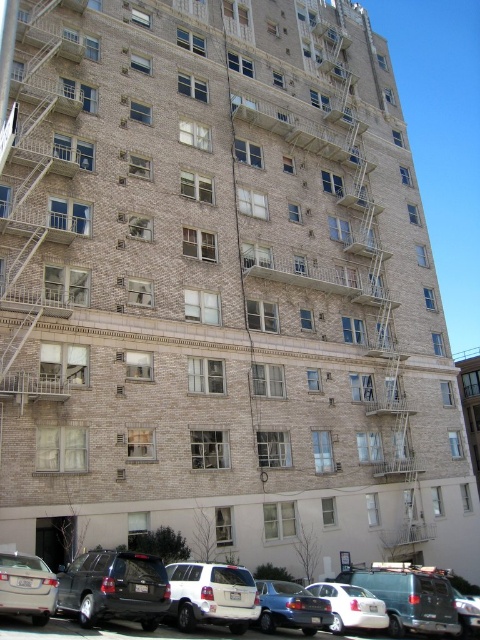
Question: Observing the image, what is the correct spatial positioning of matte black suv at lower center in reference to silver metallic sedan at lower left?

Choices:
 (A) right
 (B) left

Answer: (A)

Question: Is matte black suv at lower center positioned behind metallic silver car at center?

Choices:
 (A) no
 (B) yes

Answer: (A)

Question: Estimate the real-world distances between objects in this image. Which object is farther from the white matte suv at center?

Choices:
 (A) metallic silver car at center
 (B) white matte sedan at lower center
 (C) matte black suv at lower left
 (D) silver metallic sedan at lower left

Answer: (A)

Question: Which point is closer to the camera?

Choices:
 (A) (204, 627)
 (B) (231, 604)

Answer: (B)

Question: Where is silver metallic sedan at lower left located in relation to metallic silver car at center in the image?

Choices:
 (A) right
 (B) left

Answer: (B)

Question: Which object is closer to the camera taking this photo?

Choices:
 (A) metallic silver car at center
 (B) matte black suv at lower left
 (C) matte black suv at lower center

Answer: (C)